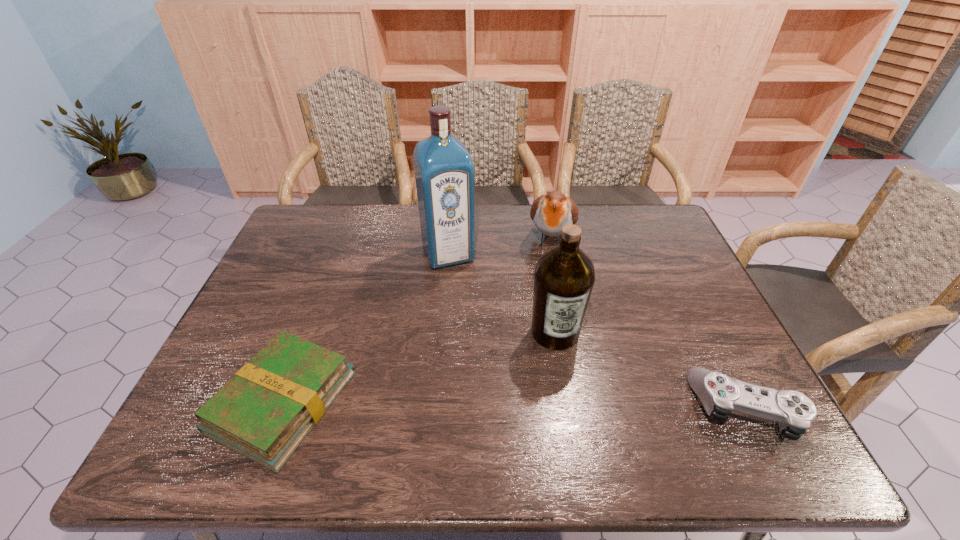
Find the location of `free region located 0.400m at the face of the bird`. free region located 0.400m at the face of the bird is located at coordinates (534, 370).

Identify the location of vacant space located 0.160m on the flat label side of the fourth object from right to left. The width and height of the screenshot is (960, 540). (470, 307).

Where is `free space located 0.330m on the flat label side of the fourth object from right to left`? This screenshot has width=960, height=540. free space located 0.330m on the flat label side of the fourth object from right to left is located at coordinates (490, 353).

What are the coordinates of `vacant space situated 0.140m on the flat label side of the fourth object from right to left` in the screenshot? It's located at (468, 302).

Where is `free spot located 0.140m on the label of the olive oil`? This screenshot has height=540, width=960. free spot located 0.140m on the label of the olive oil is located at coordinates (572, 403).

The height and width of the screenshot is (540, 960). Identify the location of free space located 0.120m on the label of the olive oil. (570, 395).

What are the coordinates of `free location located 0.110m on the label of the olive oil` in the screenshot? It's located at (569, 392).

The width and height of the screenshot is (960, 540). What are the coordinates of `bird present at the far edge` in the screenshot? It's located at (550, 212).

In order to click on liquor that is at the far edge in this screenshot , I will do `click(444, 172)`.

You are a GUI agent. You are given a task and a screenshot of the screen. Output one action in this format:
    pyautogui.click(x=<x>, y=<y>)
    Task: Click on the book that is at the near edge
    
    Given the screenshot: What is the action you would take?
    pyautogui.click(x=264, y=412)